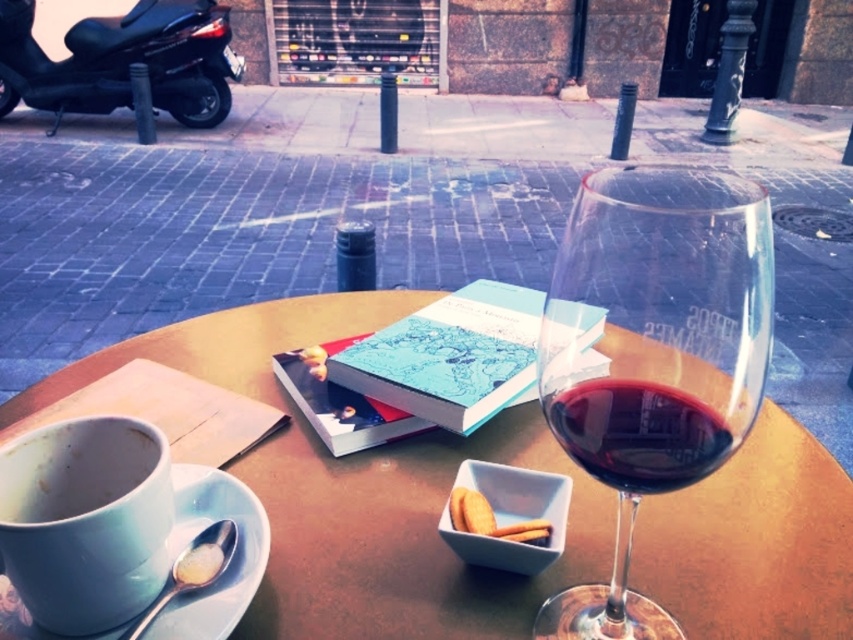
Question: Which object is closer to the camera taking this photo?

Choices:
 (A) matte ceramic mug at lower left
 (B) black matte scooter at upper left
 (C) matte brown table at center

Answer: (C)

Question: Is blue ceramic saucer at lower left above white matte biscuit at center?

Choices:
 (A) yes
 (B) no

Answer: (B)

Question: Which point is farther to the camera?

Choices:
 (A) (230, 620)
 (B) (596, 525)
 (C) (477, 518)
 (D) (45, 68)

Answer: (D)

Question: Which of the following is the closest to the observer?

Choices:
 (A) (726, 488)
 (B) (200, 48)
 (C) (660, 436)
 (D) (457, 508)

Answer: (C)

Question: Can you confirm if black matte scooter at upper left is bigger than transparent glass at center?

Choices:
 (A) yes
 (B) no

Answer: (A)

Question: Is the position of transparent glass wine glass at center more distant than that of transparent glass at center?

Choices:
 (A) yes
 (B) no

Answer: (B)